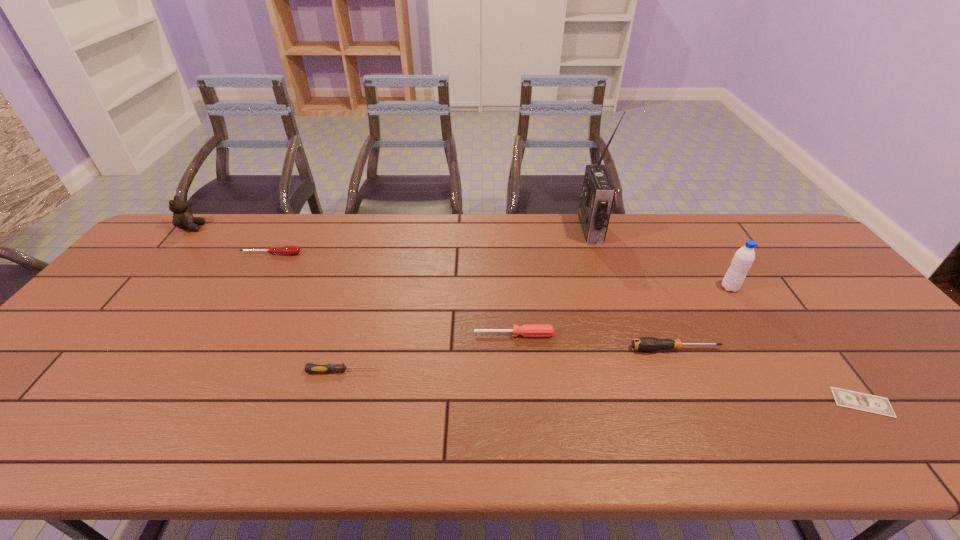
This screenshot has width=960, height=540. What are the coordinates of `object situated at the right edge` in the screenshot? It's located at pyautogui.click(x=845, y=398).

At what (x,y) coordinates should I click in order to perform the action: click on object located at the far left corner. Please return your answer as a coordinate pair (x, y). Image resolution: width=960 pixels, height=540 pixels. Looking at the image, I should click on (182, 217).

The width and height of the screenshot is (960, 540). I want to click on object that is at the near right corner, so click(x=845, y=398).

In the image, there is a desktop. Identify the location of vacant region at the far edge. This screenshot has height=540, width=960. (328, 241).

This screenshot has width=960, height=540. In the image, there is a desktop. What are the coordinates of `vacant space at the near edge` in the screenshot? It's located at pos(336,431).

Find the location of a particular element. The image size is (960, 540). vacant position at the left edge of the desktop is located at coordinates (61, 387).

Where is `blank space at the right edge`? Image resolution: width=960 pixels, height=540 pixels. blank space at the right edge is located at coordinates (847, 322).

The image size is (960, 540). Identify the location of free spot between the second object from left to right and the fifth nearest object. (500, 271).

What are the coordinates of `unoccupied area between the rightmost screwdriver and the shortest screwdriver` in the screenshot? It's located at (509, 360).

Identify the location of free space that is in between the fourth nearest object and the farthest screwdriver. (393, 294).